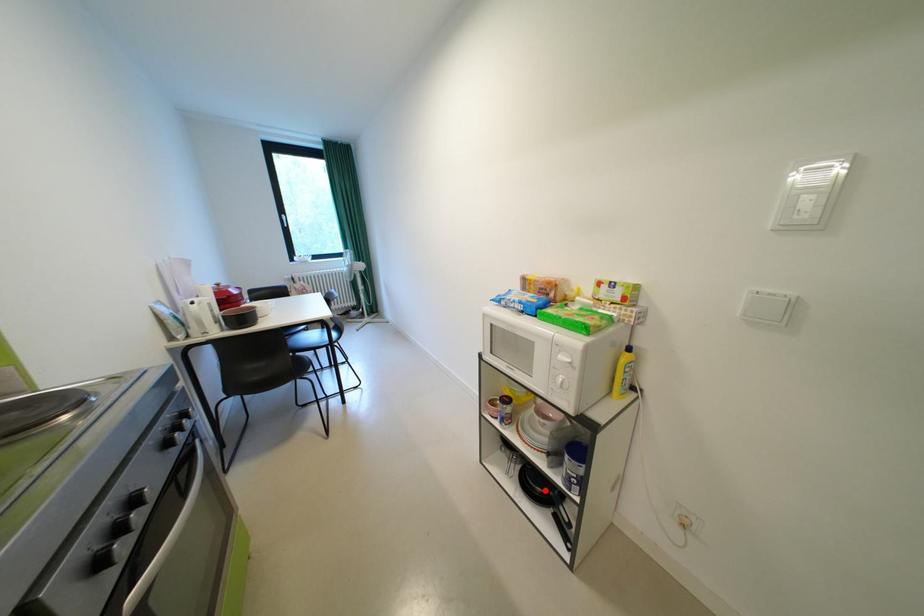
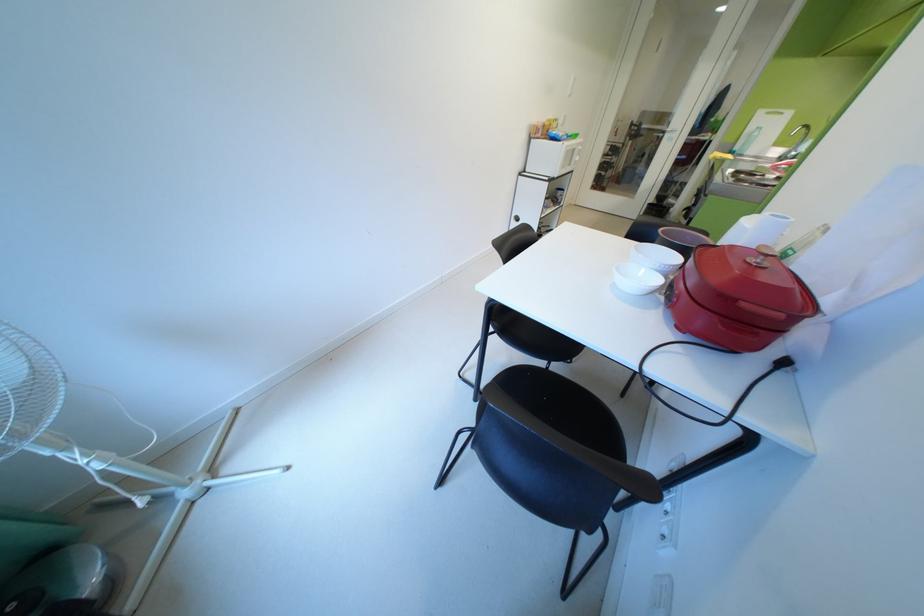
Question: I am providing you with two images of the same scene from different viewpoints. A red point is marked on the first image. Is the red point's position out of view in image 2?

Choices:
 (A) Yes
 (B) No

Answer: (A)